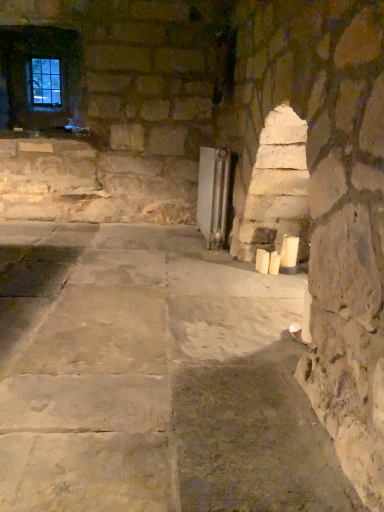
Question: Based on their sizes in the image, would you say white wax candle at right, placed as the 1th candle when sorted from right to left, is bigger or smaller than white wax candle at lower right, acting as the 2th candle starting from the right?

Choices:
 (A) big
 (B) small

Answer: (A)

Question: Considering the relative positions of white wax candle at right, placed as the 1th candle when sorted from right to left, and white wax candle at lower right, the second candle positioned from the left, in the image provided, is white wax candle at right, placed as the 1th candle when sorted from right to left, to the left or to the right of white wax candle at lower right, the second candle positioned from the left,?

Choices:
 (A) left
 (B) right

Answer: (B)

Question: Based on their relative distances, which object is farther from the clear glass window at upper left?

Choices:
 (A) white matte candle at center-right, the 1th candle viewed from the left
 (B) white wax candle at lower right, acting as the 2th candle starting from the right
 (C) white wax candle at right, placed as the 1th candle when sorted from right to left

Answer: (B)

Question: Considering the real-world distances, which object is farthest from the white wax candle at lower right, the second candle positioned from the left?

Choices:
 (A) white wax candle at right, the third candle positioned from the left
 (B) white matte candle at center-right, the 1th candle viewed from the left
 (C) clear glass window at upper left

Answer: (C)